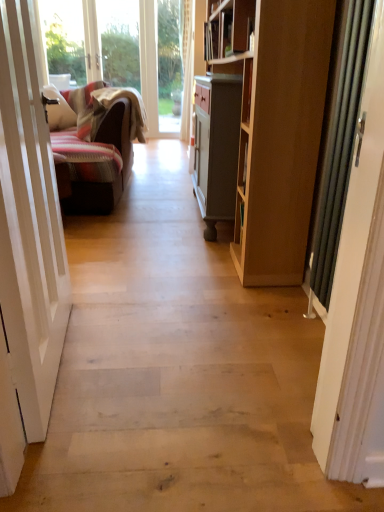
Question: From their relative heights in the image, would you say white glossy door at left, which ranks as the 1th door in left-to-right order, is taller or shorter than natural wood floor at center?

Choices:
 (A) tall
 (B) short

Answer: (A)

Question: From the image's perspective, is white glossy door at left, which appears as the second door when viewed from the right, positioned above or below natural wood floor at center?

Choices:
 (A) above
 (B) below

Answer: (A)

Question: Based on their relative distances, which object is nearer to the white glossy door at left, which ranks as the 1th door in left-to-right order?

Choices:
 (A) natural wood floor at center
 (B) metallic silver door at right, placed as the second door when sorted from left to right

Answer: (A)

Question: Which object is the farthest from the metallic silver door at right, placed as the second door when sorted from left to right?

Choices:
 (A) natural wood floor at center
 (B) white glossy door at left, which appears as the second door when viewed from the right

Answer: (B)